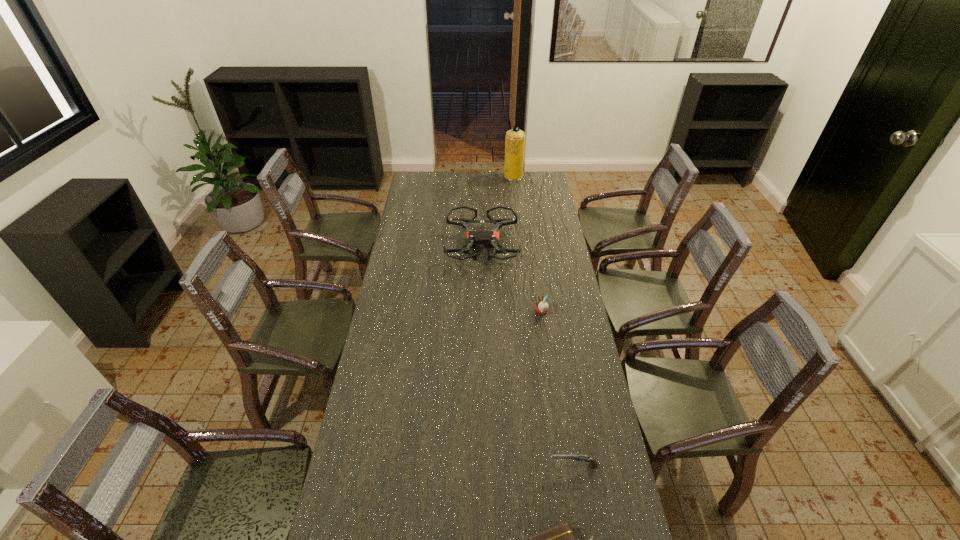
Locate an element on the screen. The image size is (960, 540). vacant region located 0.350m aiming along the barrel of the fourth farthest object is located at coordinates (433, 465).

Locate an element on the screen. Image resolution: width=960 pixels, height=540 pixels. vacant space situated 0.350m aiming along the barrel of the fourth farthest object is located at coordinates (433, 465).

Identify the location of free spot located aiming along the barrel of the fourth farthest object. (423, 465).

Identify the location of object at the far edge. (515, 138).

Locate an element on the screen. aerosol can positioned at the right edge is located at coordinates (515, 138).

The image size is (960, 540). Find the location of `muffin positioned at the right edge`. muffin positioned at the right edge is located at coordinates (542, 306).

Identify the location of gun that is at the right edge. (593, 463).

Where is `object that is at the far right corner`? This screenshot has height=540, width=960. object that is at the far right corner is located at coordinates (515, 138).

Find the location of a particular element. This screenshot has height=540, width=960. vacant region at the far edge of the desktop is located at coordinates (501, 171).

Find the location of `free spot at the left edge of the desktop`. free spot at the left edge of the desktop is located at coordinates (424, 234).